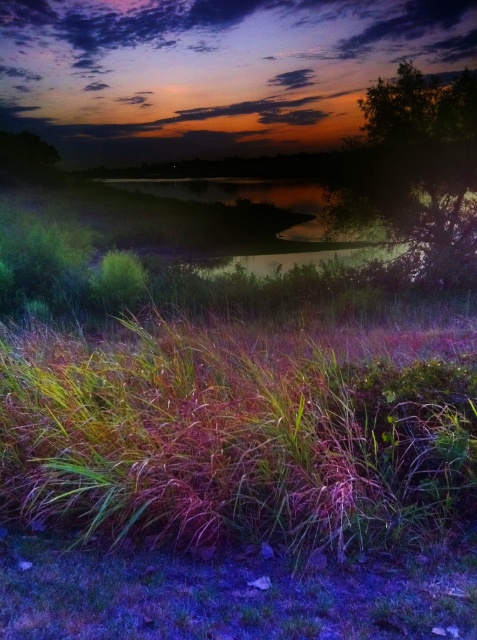
You are an observer looking at the twilight scene. You notice two green leafy trees in the upper corners of the image. Which tree is closer to you, the green leafy tree at upper right or the green leafy tree at upper left?

The green leafy tree at upper right is closer to you because it is in front of the green leafy tree at upper left.

You are a photographer adjusting your camera settings to focus on two specific points in the twilight scene. The first point is at coordinates point (434,170), and the second is at point (8,147). Based on the scene, which point should you focus on to ensure the foreground elements are sharp?

Point (434,170) is closer to the camera than point (8,147), so focusing on point (434,170) will ensure the foreground elements are sharp.